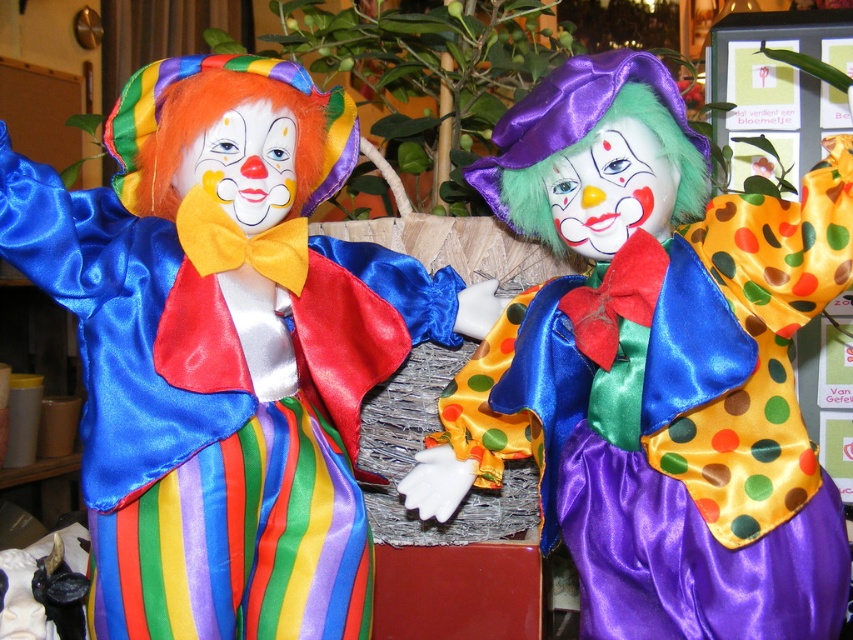
Question: Is satin clown at left closer to the viewer compared to polka dot satin clown at center?

Choices:
 (A) yes
 (B) no

Answer: (A)

Question: Which of the following is the farthest from the observer?

Choices:
 (A) (241, 154)
 (B) (579, 481)

Answer: (B)

Question: Can you confirm if satin clown at left is wider than polka dot satin clown at center?

Choices:
 (A) no
 (B) yes

Answer: (B)

Question: Which point is farther to the camera?

Choices:
 (A) satin clown at left
 (B) polka dot satin clown at center

Answer: (B)

Question: Does satin clown at left lie behind polka dot satin clown at center?

Choices:
 (A) no
 (B) yes

Answer: (A)